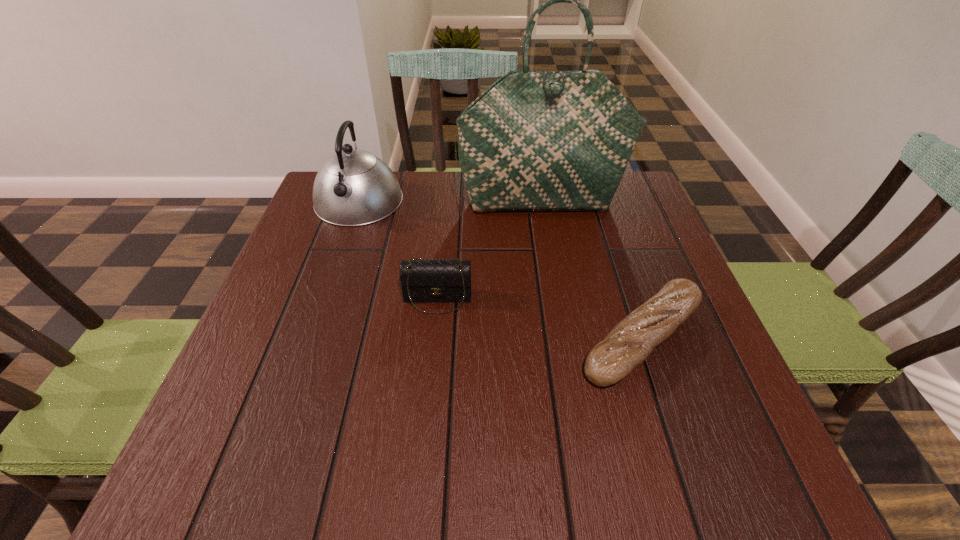
I want to click on kettle situated at the far edge, so click(x=353, y=187).

I want to click on object present at the left edge, so click(x=353, y=187).

Find the location of `tote bag at the right edge`. tote bag at the right edge is located at coordinates (534, 140).

Find the location of a particular element. This screenshot has height=540, width=960. baguet that is at the right edge is located at coordinates (631, 341).

The image size is (960, 540). Identify the location of object situated at the far left corner. (353, 187).

Locate an element on the screen. The height and width of the screenshot is (540, 960). object situated at the far right corner is located at coordinates (534, 140).

Identify the location of vacant area at the near edge of the desktop. (570, 461).

The height and width of the screenshot is (540, 960). What are the coordinates of `vacant space at the left edge of the desktop` in the screenshot? It's located at (327, 286).

Identify the location of vacant region at the right edge. The image size is (960, 540). (624, 237).

In the image, there is a desktop. At what (x,y) coordinates should I click in order to perform the action: click on vacant region at the near left corner. Please return your answer as a coordinate pair (x, y). This screenshot has width=960, height=540. Looking at the image, I should click on (214, 474).